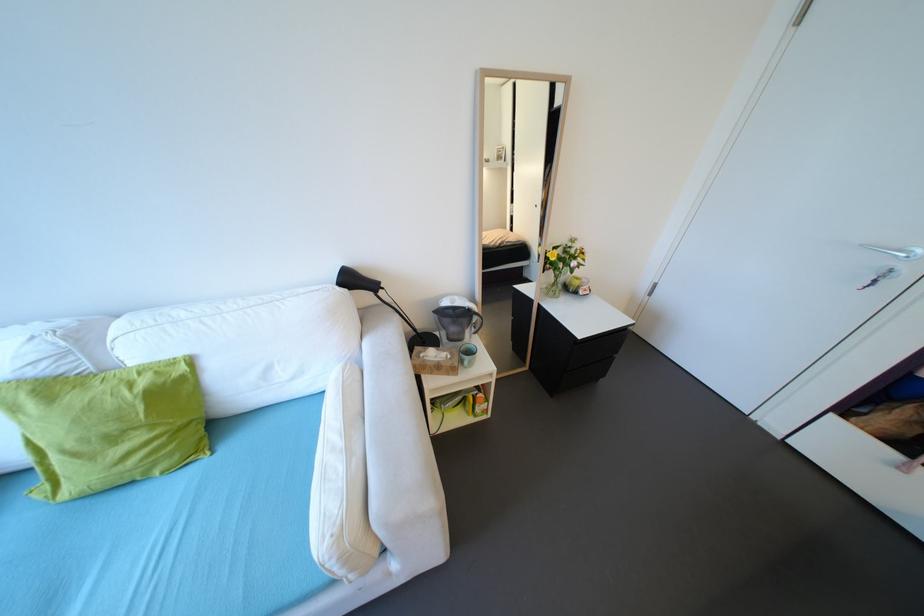
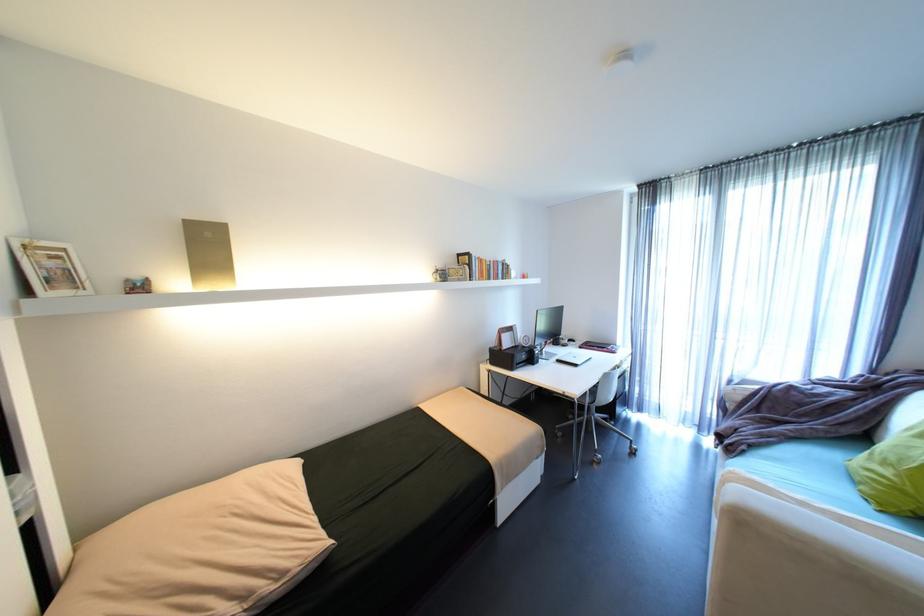
Find the pixel in the second image that matches (160,428) in the first image.

(906, 476)